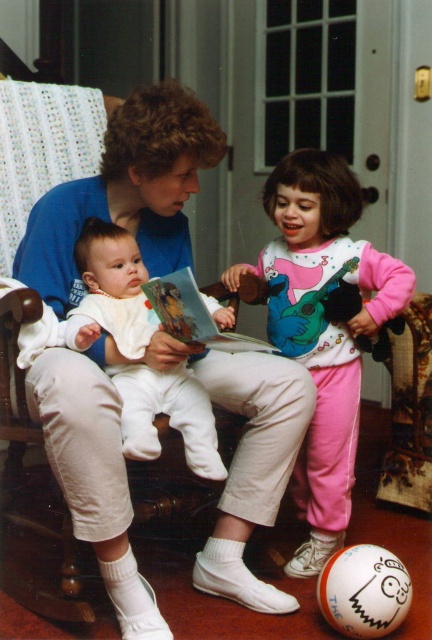
You are a photographer taking a picture of the white soft baby at center and the matte paper book at center. Which object is closer to the camera?

The white soft baby at center is closer to the camera than the matte paper book at center because it is positioned under it.

Based on the scene description, where is the matte blue shirt at center located in the image?

The matte blue shirt at center is located at point (127, 192).